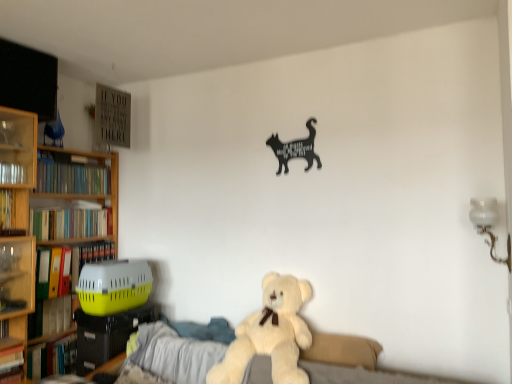
Find the location of `blank space above hardcover books at left, placed as the 3th book when sorted from top to bottom (from a real-world perspective)`. blank space above hardcover books at left, placed as the 3th book when sorted from top to bottom (from a real-world perspective) is located at coordinates (71, 206).